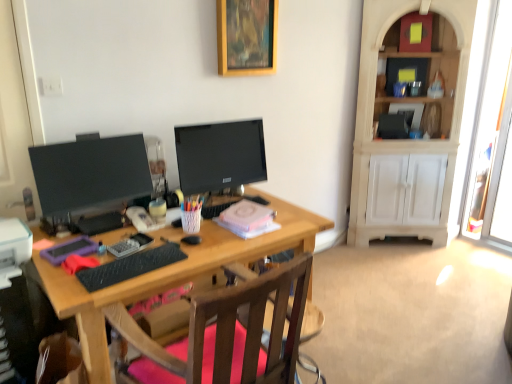
The image size is (512, 384). Find the location of `empty space that is ontop of black rubberized keyboard at center (from a real-world perspective)`. empty space that is ontop of black rubberized keyboard at center (from a real-world perspective) is located at coordinates (117, 267).